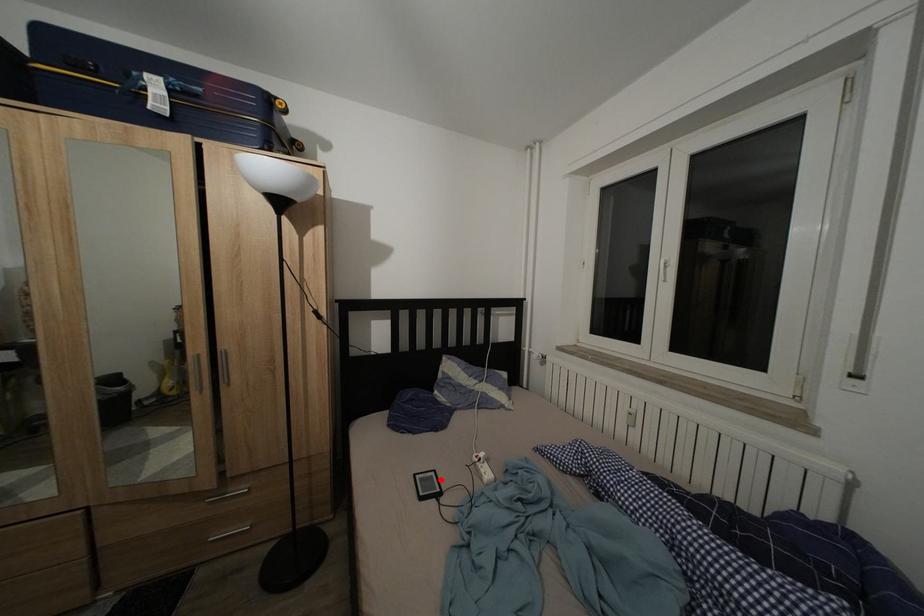
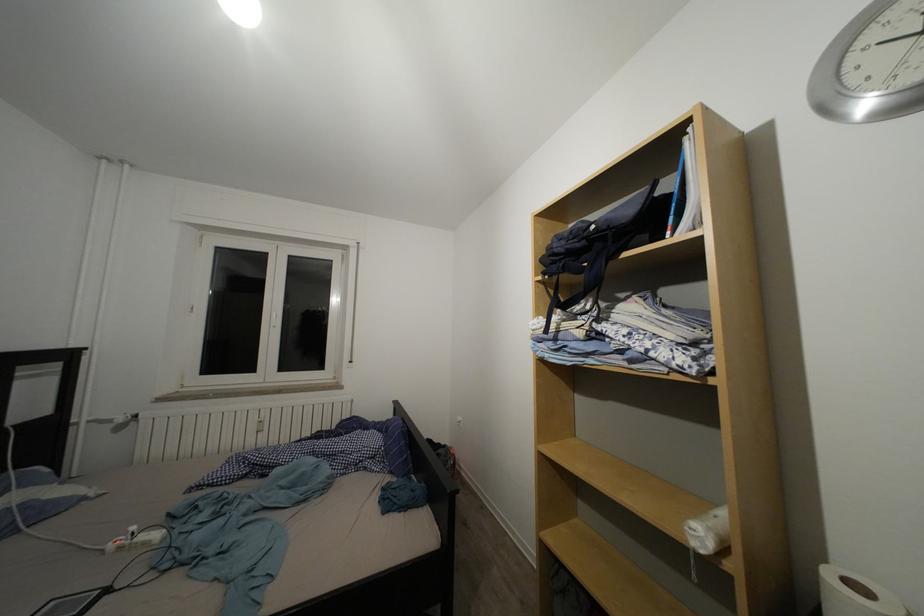
Find the pixel in the second image that matches the highlighted location in the first image.

(61, 610)